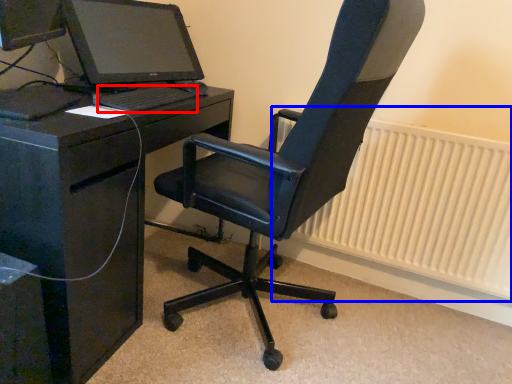
Question: Which point is closer to the camera, computer keyboard (highlighted by a red box) or radiator (highlighted by a blue box)?

Choices:
 (A) computer keyboard
 (B) radiator

Answer: (A)